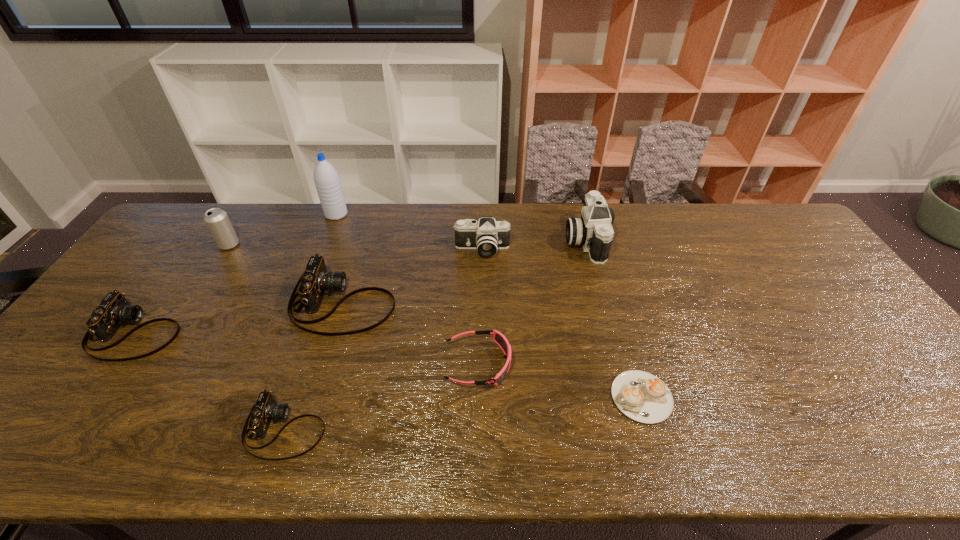
I want to click on blank region between the smaller black camera and the goggles, so 480,306.

Locate an element on the screen. Image resolution: width=960 pixels, height=540 pixels. empty space that is in between the leftmost brown camera and the third shortest camera is located at coordinates (239, 317).

This screenshot has width=960, height=540. Identify the location of free space between the cappuccino and the smaller black camera. (562, 323).

Locate an element on the screen. This screenshot has height=540, width=960. free spot between the tallest camera and the sixth tallest object is located at coordinates (360, 286).

Find the location of a particular element. The width and height of the screenshot is (960, 540). object that ranks as the eighth closest to the water bottle is located at coordinates (643, 397).

I want to click on object that ranks as the fifth closest to the water bottle, so point(499,338).

Where is `camera that stands as the closest to the smallest brown camera`? The height and width of the screenshot is (540, 960). camera that stands as the closest to the smallest brown camera is located at coordinates (315, 281).

Point out which camera is positioned as the nearest to the fifth tallest object. Please provide its 2D coordinates. Your answer should be formatted as a tuple, i.e. [(x, y)], where the tuple contains the x and y coordinates of a point satisfying the conditions above.

[(487, 235)]

Identify the location of brown camera identified as the closest to the shortest camera. This screenshot has height=540, width=960. (315, 281).

Identify which brown camera is the third nearest to the smaller black camera. Please provide its 2D coordinates. Your answer should be formatted as a tuple, i.e. [(x, y)], where the tuple contains the x and y coordinates of a point satisfying the conditions above.

[(114, 310)]